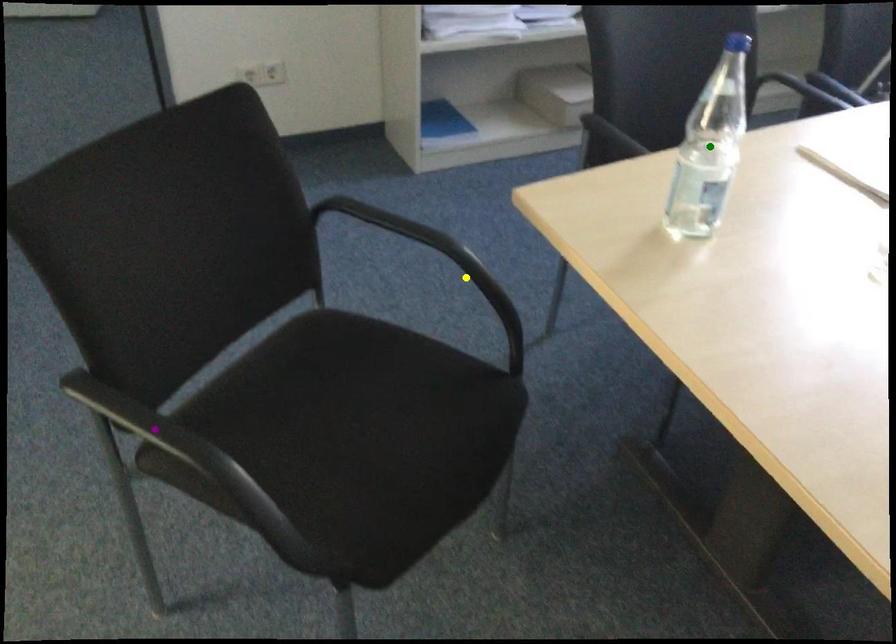
Order these from farthest to nearest:
purple point, yellow point, green point

yellow point < green point < purple point